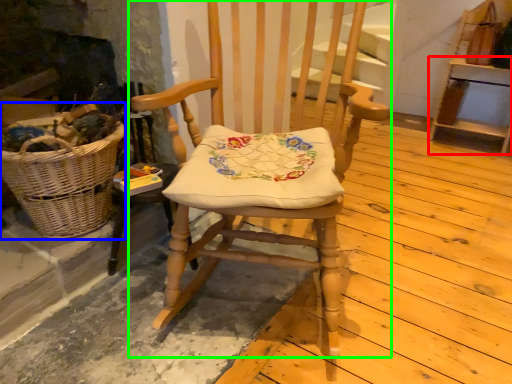
Question: Which object is the farthest from furniture (highlighted by a red box)? Choose among these: picnic basket (highlighted by a blue box) or chair (highlighted by a green box).

Choices:
 (A) picnic basket
 (B) chair

Answer: (A)